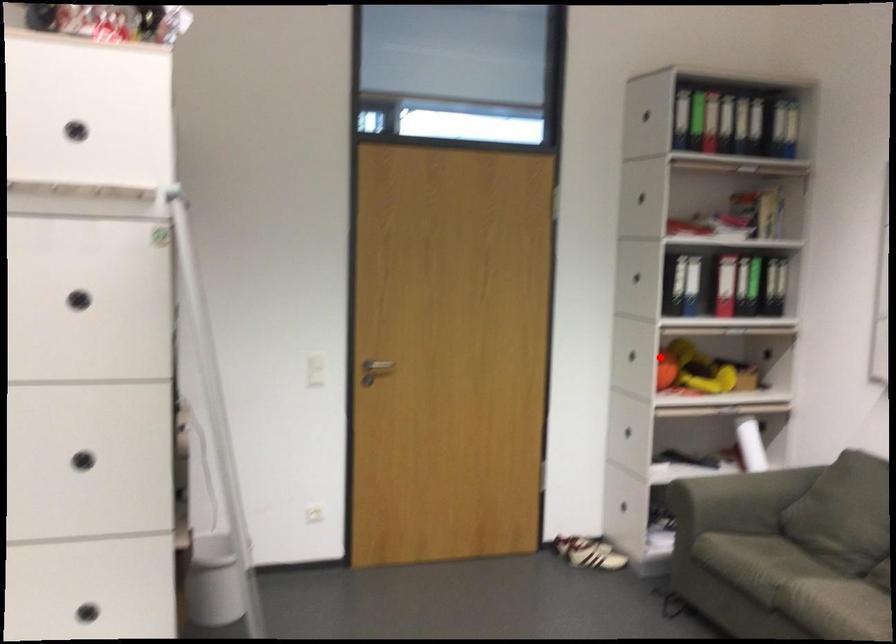
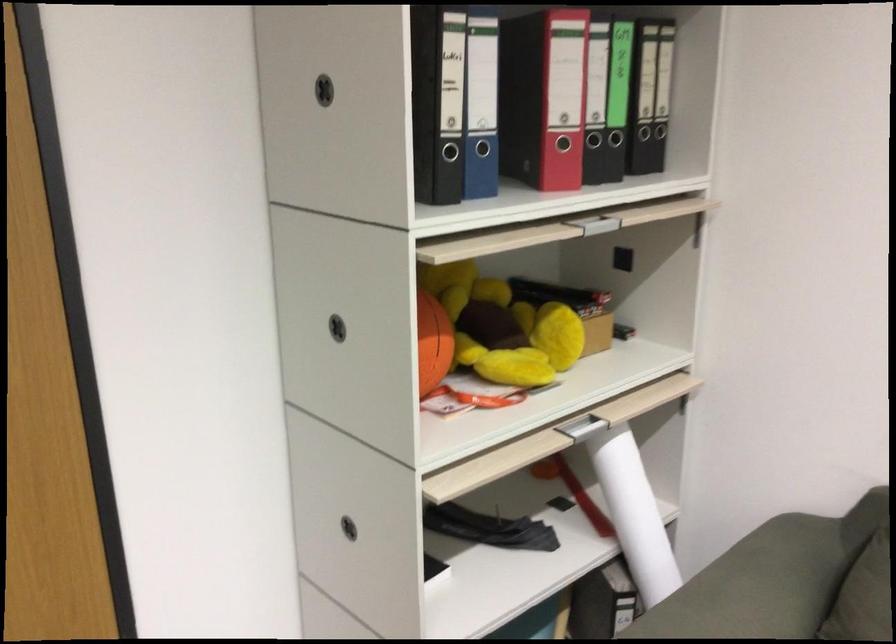
The point at the highlighted location is marked in the first image. Where is the corresponding point in the second image?

(433, 343)